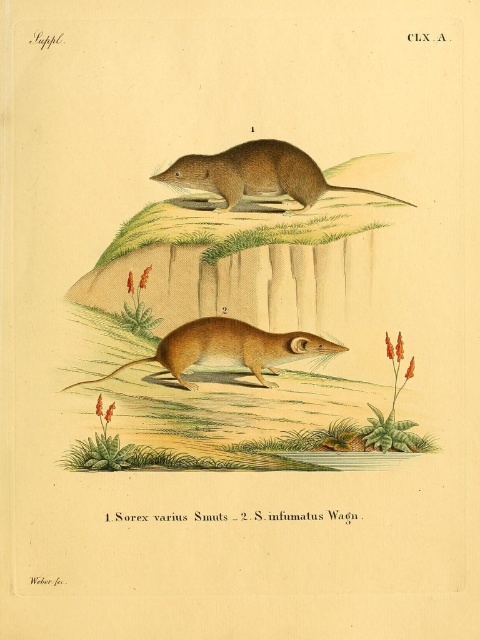
Question: Does brown fur mouse at center appear on the left side of golden-brown fur mouse at center?

Choices:
 (A) yes
 (B) no

Answer: (B)

Question: From the image, what is the correct spatial relationship of brown furry mouse at upper center in relation to golden-brown fur mouse at center?

Choices:
 (A) below
 (B) above

Answer: (B)

Question: Which of the following is the farthest from the observer?

Choices:
 (A) (84, 310)
 (B) (302, 202)

Answer: (B)

Question: Can you confirm if brown fur mouse at center is positioned above brown furry mouse at upper center?

Choices:
 (A) yes
 (B) no

Answer: (B)

Question: Based on their relative distances, which object is farther from the brown furry mouse at upper center?

Choices:
 (A) golden-brown fur mouse at center
 (B) brown fur mouse at center

Answer: (A)

Question: Considering the real-world distances, which object is closest to the brown furry mouse at upper center?

Choices:
 (A) golden-brown fur mouse at center
 (B) brown fur mouse at center

Answer: (B)